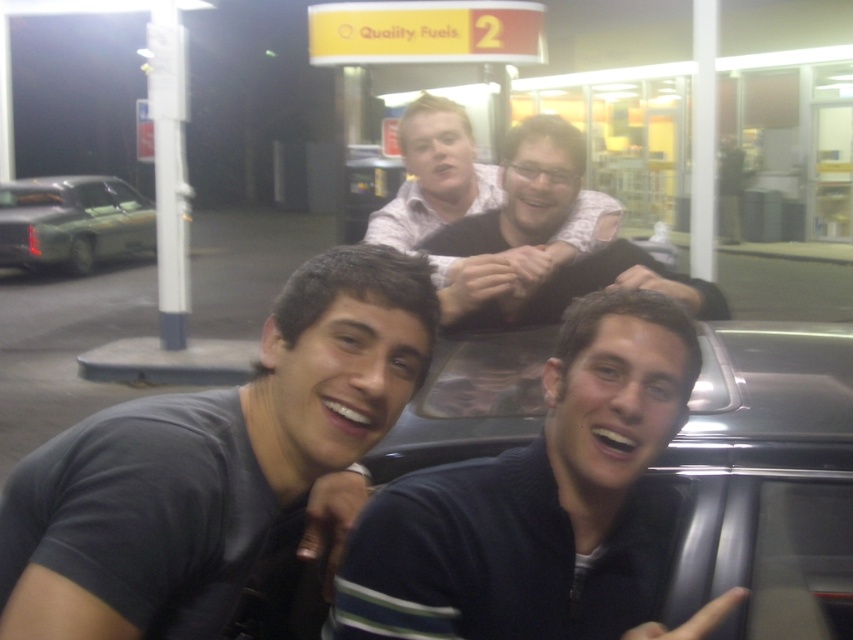
Question: Which point appears closest to the camera in this image?

Choices:
 (A) (599, 230)
 (B) (517, 298)

Answer: (B)

Question: Which object appears farthest from the camera in this image?

Choices:
 (A) matte black shirt at upper center
 (B) dark blue sweater at center

Answer: (A)

Question: Is matte black shirt at center behind matte black shirt at upper center?

Choices:
 (A) yes
 (B) no

Answer: (B)

Question: Does dark gray t-shirt at center have a lesser width compared to matte black shirt at upper center?

Choices:
 (A) no
 (B) yes

Answer: (A)

Question: Which point is farther from the camera taking this photo?

Choices:
 (A) (190, 545)
 (B) (622, 609)
 (C) (57, 198)
 (D) (660, 273)

Answer: (C)

Question: Can you confirm if dark blue sweater at center is positioned below matte black shirt at center?

Choices:
 (A) yes
 (B) no

Answer: (A)